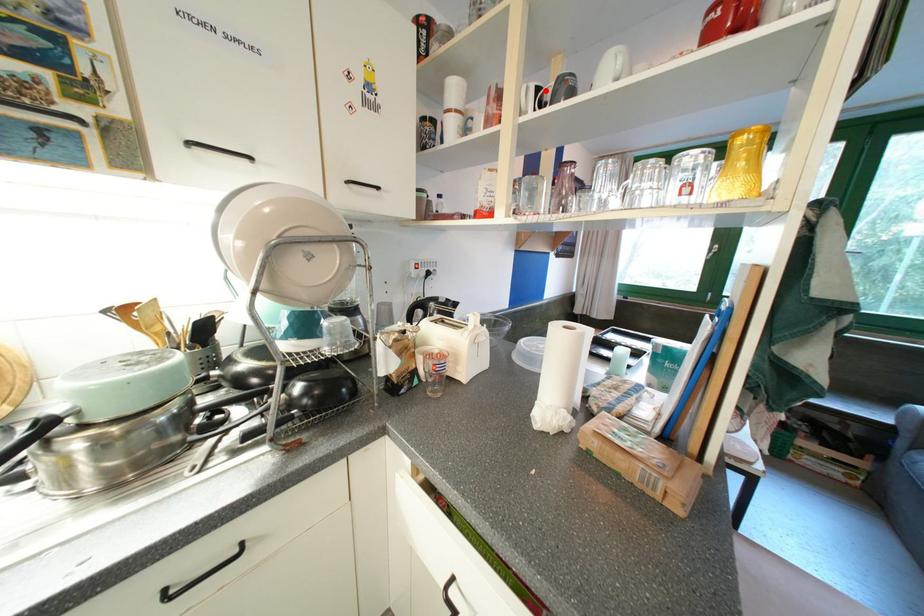
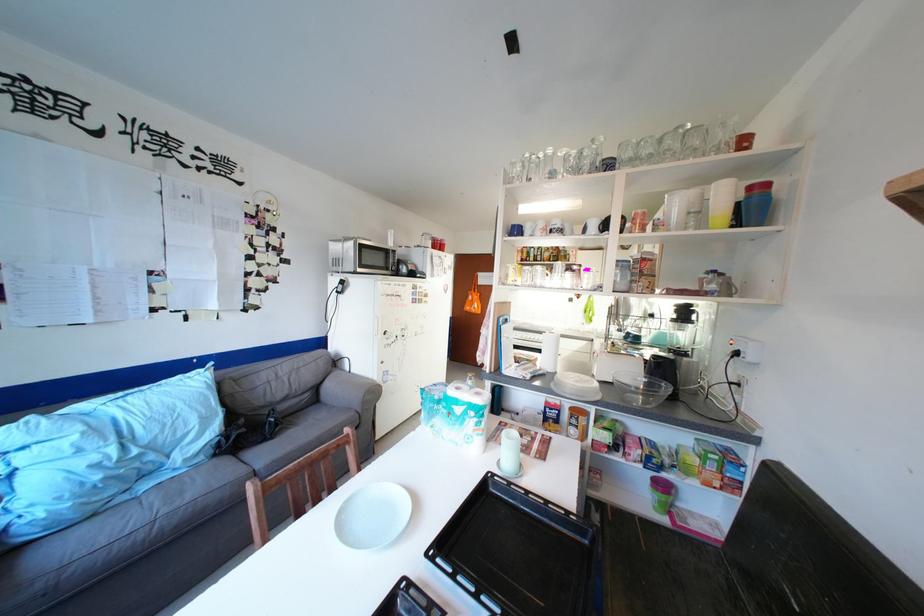
Question: I am providing you with two images of the same scene from different viewpoints. A red point is marked on the first image. Is the red point's position out of view in image 2?

Choices:
 (A) Yes
 (B) No

Answer: (A)